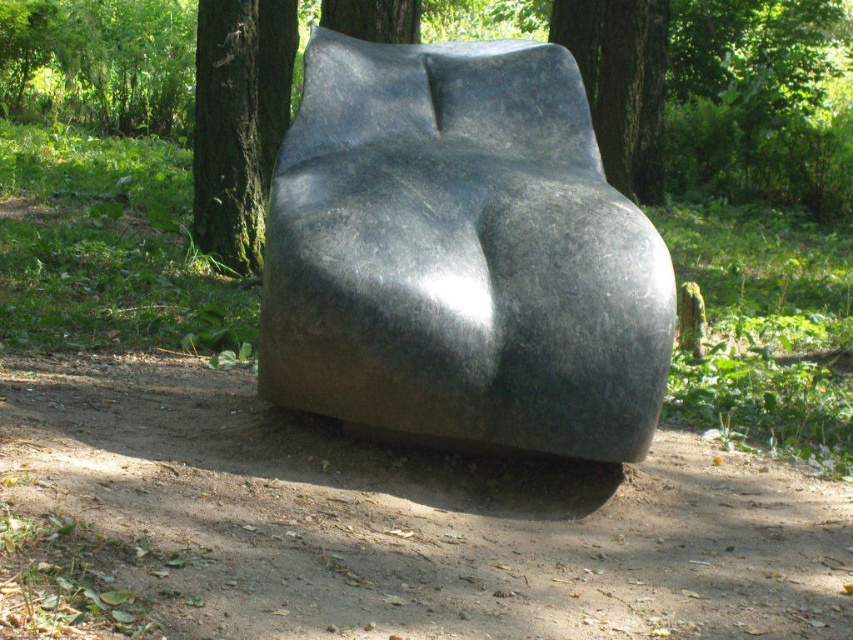
You are an artist planning to paint the sculpture. You notice two trees in the background. Which tree, the green mossy bark tree at center or the smooth bark tree at upper center, would you say is larger in size?

The green mossy bark tree at center is bigger than the smooth bark tree at upper center.

You are an artist planning to photograph the glossy black sculpture at center and the green mossy bark tree at center from a distance. Which object will appear smaller in your photo?

The glossy black sculpture at center will appear smaller in the photo because it is not as tall as the green mossy bark tree at center.